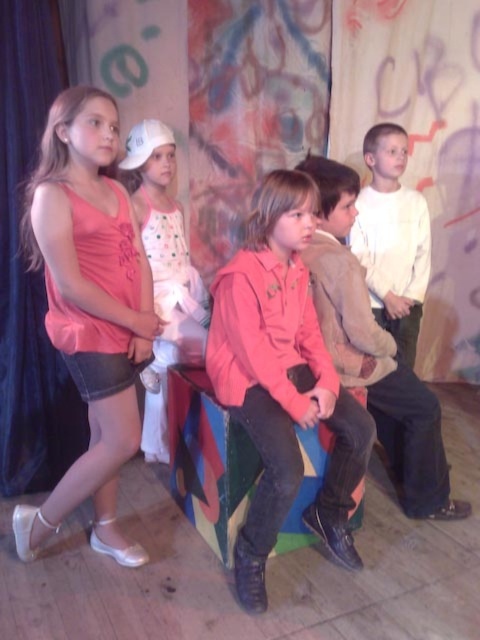
Does pink fabric dress at left appear over white matte shirt at upper right?

Incorrect, pink fabric dress at left is not positioned above white matte shirt at upper right.

Based on the photo, how distant is pink fabric dress at left from white matte shirt at upper right?

pink fabric dress at left is 1.43 meters away from white matte shirt at upper right.

Which is behind, point (129, 390) or point (375, 211)?

The point (375, 211) is behind.

Locate an element on the screen. Image resolution: width=480 pixels, height=640 pixels. pink fabric dress at left is located at coordinates (90, 308).

From the picture: How distant is pink fabric dress at left from pink fleece jacket at center?

The distance of pink fabric dress at left from pink fleece jacket at center is 20.42 inches.

Describe the element at coordinates (90, 308) in the screenshot. I see `pink fabric dress at left` at that location.

This screenshot has height=640, width=480. In order to click on pink fabric dress at left in this screenshot , I will do `click(90, 308)`.

Who is more distant from viewer, (334,460) or (412,352)?

The point (412,352) is behind.

Does pink fleece jacket at center have a greater width compared to white matte shirt at upper right?

Yes.

Where is `pink fleece jacket at center`? The height and width of the screenshot is (640, 480). pink fleece jacket at center is located at coordinates (283, 380).

Find the location of a particular element. The image size is (480, 640). pink fleece jacket at center is located at coordinates (283, 380).